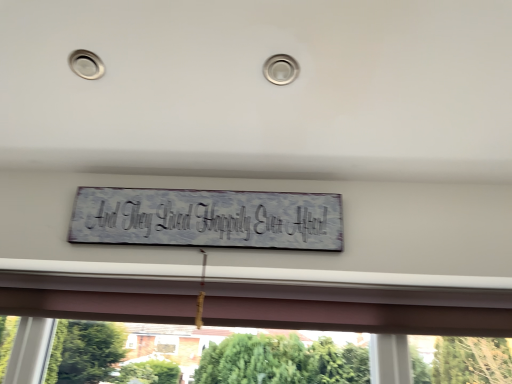
Question: From the image's perspective, relative to white distressed wood sign at center, is transparent glass window at center above or below?

Choices:
 (A) above
 (B) below

Answer: (B)

Question: Based on their sizes in the image, would you say transparent glass window at center is bigger or smaller than white distressed wood sign at center?

Choices:
 (A) small
 (B) big

Answer: (B)

Question: Is transparent glass window at center inside the boundaries of white distressed wood sign at center, or outside?

Choices:
 (A) outside
 (B) inside

Answer: (A)

Question: Looking at their shapes, would you say white distressed wood sign at center is wider or thinner than transparent glass window at center?

Choices:
 (A) wide
 (B) thin

Answer: (B)

Question: Is white distressed wood sign at center situated inside transparent glass window at center or outside?

Choices:
 (A) outside
 (B) inside

Answer: (A)

Question: Visually, is white distressed wood sign at center positioned to the left or to the right of transparent glass window at center?

Choices:
 (A) left
 (B) right

Answer: (A)

Question: Considering their positions, is white distressed wood sign at center located in front of or behind transparent glass window at center?

Choices:
 (A) front
 (B) behind

Answer: (A)